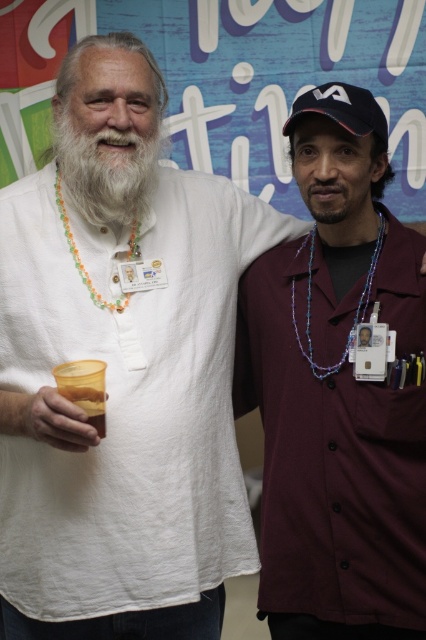
Question: Which object is farther from the camera taking this photo?

Choices:
 (A) navy blue fabric baseball cap at upper right
 (B) maroon button-up shirt at right
 (C) blue beaded necklace at center

Answer: (C)

Question: Can you confirm if dark brown fuzzy beard at center is bigger than multicolored beaded necklace at left?

Choices:
 (A) no
 (B) yes

Answer: (A)

Question: From the image, what is the correct spatial relationship of whitewool-likebeard at left in relation to multicolored beaded necklace at left?

Choices:
 (A) left
 (B) right

Answer: (B)

Question: Which object is the closest to the maroon button-up shirt at right?

Choices:
 (A) whitewool-likebeard at left
 (B) matte plastic cup at lower left
 (C) dark brown fuzzy beard at center
 (D) multicolored beaded necklace at left

Answer: (C)

Question: Where is whitewool-likebeard at left located in relation to matte plastic cup at lower left in the image?

Choices:
 (A) below
 (B) above

Answer: (B)

Question: Which object is the closest to the whitewool-likebeard at left?

Choices:
 (A) dark brown fuzzy beard at center
 (B) multicolored beaded necklace at left

Answer: (B)